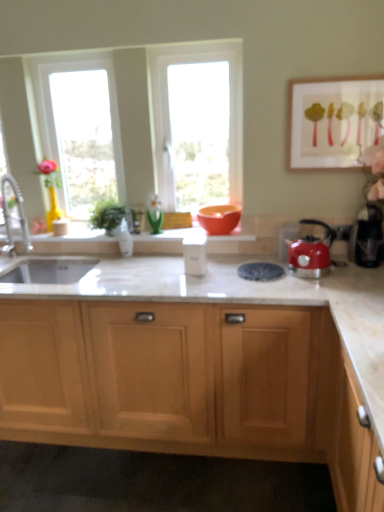
At what (x,y) coordinates should I click in order to perform the action: click on vacant area that lies to the right of white glossy container at center. Please return your answer as a coordinate pair (x, y). Looking at the image, I should click on (222, 271).